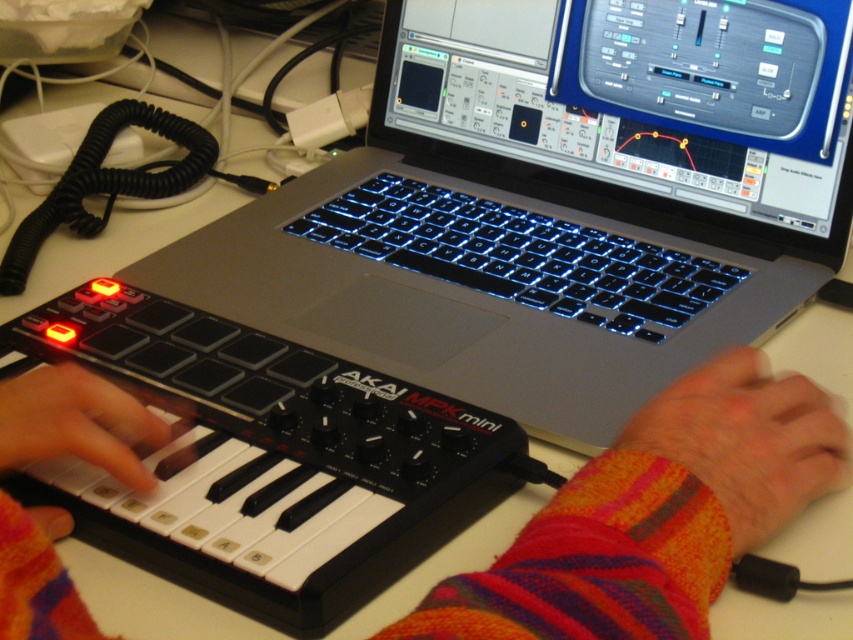
You are a music producer working on a track and need to reach for your AKAI MPK mini. Where should you look relative to the plaid sweater at lower left?

The AKAI MPK mini is located to the right of the plaid sweater at lower left since the plaid sweater is positioned at point (654, 515), which is lower left in the image.